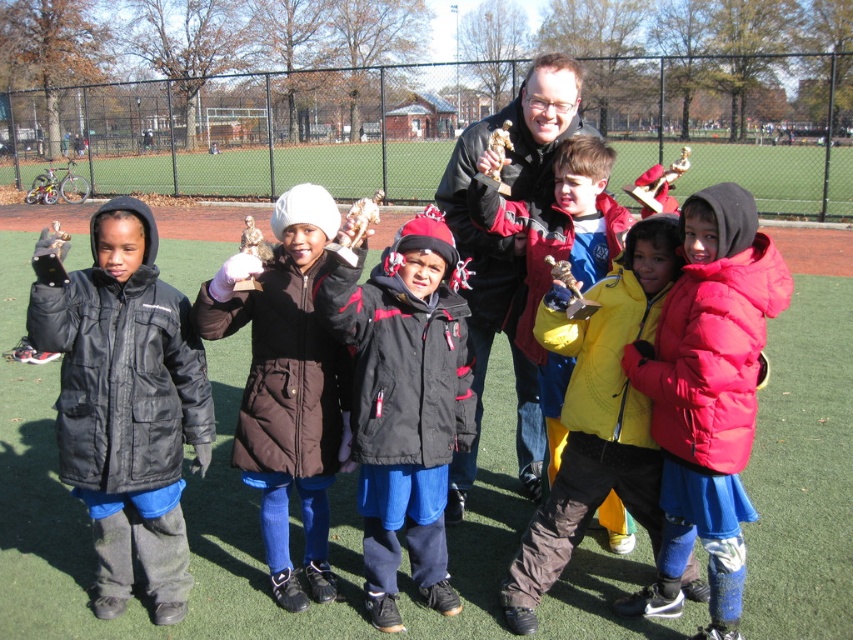
The height and width of the screenshot is (640, 853). What do you see at coordinates (708, 397) in the screenshot?
I see `red puffy jacket at center` at bounding box center [708, 397].

Between point (721, 444) and point (380, 417), which one is positioned behind?

Positioned behind is point (380, 417).

Between point (723, 422) and point (386, 493), which one is positioned in front?

Point (723, 422)

Locate an element on the screen. Image resolution: width=853 pixels, height=640 pixels. red puffy jacket at center is located at coordinates (708, 397).

Between point (480, 323) and point (505, 216), which one is positioned behind?

Positioned behind is point (480, 323).

Is matte black jacket at center smaller than yellow matte jacket at center?

Indeed, matte black jacket at center has a smaller size compared to yellow matte jacket at center.

Who is more distant from viewer, (503, 324) or (622, 212)?

Positioned behind is point (503, 324).

Image resolution: width=853 pixels, height=640 pixels. Find the location of `matte black jacket at center`. matte black jacket at center is located at coordinates (514, 234).

Is black puffy jacket at left in front of red puffy jacket at center?

No, black puffy jacket at left is behind red puffy jacket at center.

Between black puffy jacket at left and red puffy jacket at center, which one appears on the right side from the viewer's perspective?

red puffy jacket at center is more to the right.

Which is in front, point (57, 262) or point (717, 461)?

Point (717, 461)

Image resolution: width=853 pixels, height=640 pixels. Find the location of `black puffy jacket at left`. black puffy jacket at left is located at coordinates (125, 401).